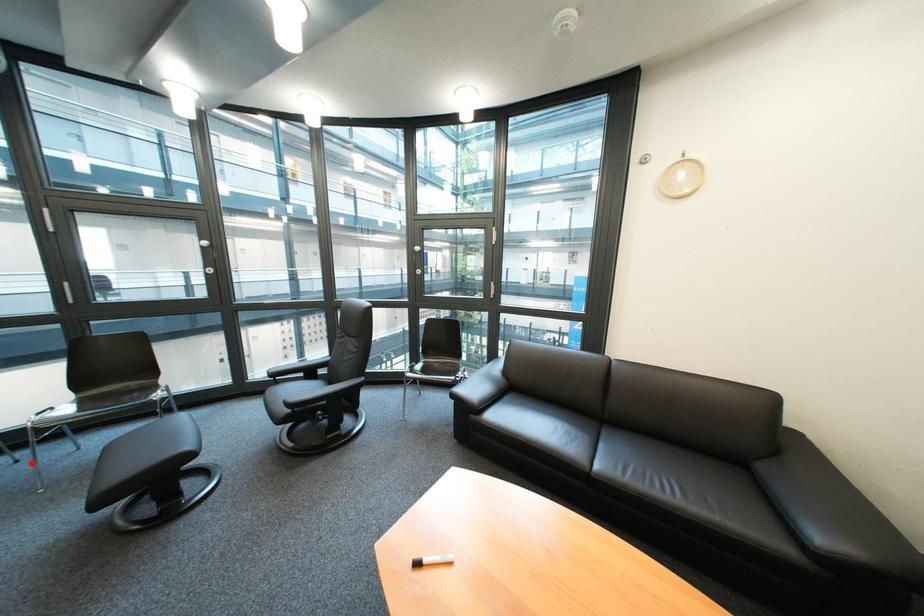
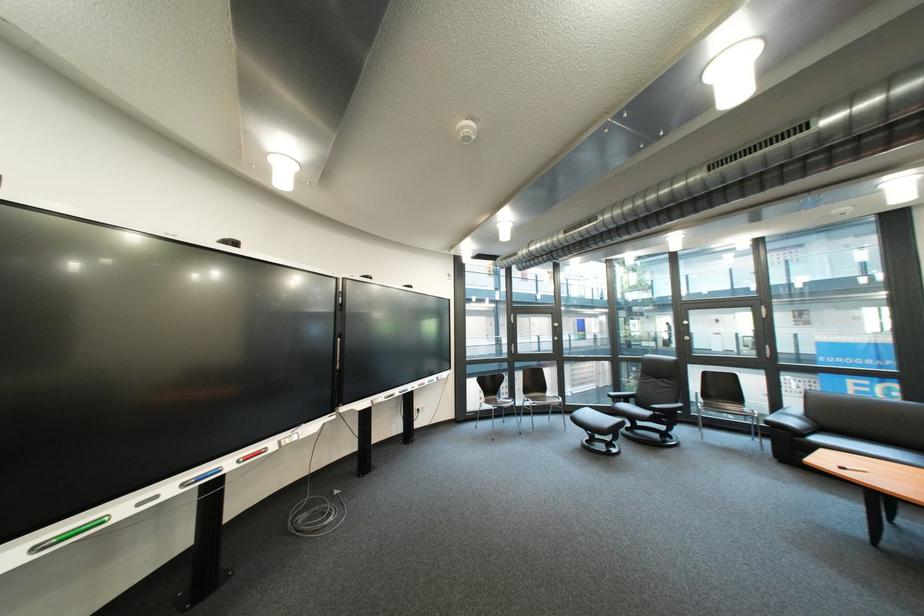
Find the pixel in the second image that matches the highlighted location in the first image.

(517, 424)